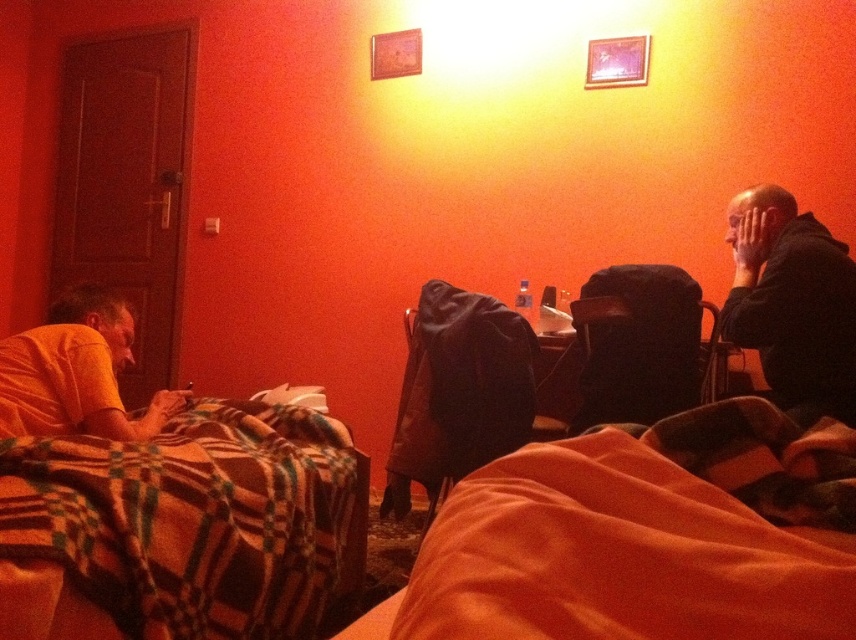
Does plaid fabric blanket at lower left appear under black hoodie at right?

Yes, plaid fabric blanket at lower left is below black hoodie at right.

Which is behind, point (200, 448) or point (792, 387)?

Positioned behind is point (792, 387).

The height and width of the screenshot is (640, 856). What are the coordinates of `plaid fabric blanket at lower left` in the screenshot? It's located at (192, 518).

Is orange soft fabric blanket at lower right positioned behind black hoodie at right?

No, it is in front of black hoodie at right.

Who is positioned more to the left, orange soft fabric blanket at lower right or black hoodie at right?

orange soft fabric blanket at lower right

Is point (605, 465) positioned in front of point (747, 333)?

Yes, point (605, 465) is in front of point (747, 333).

The image size is (856, 640). I want to click on orange soft fabric blanket at lower right, so click(x=649, y=536).

Between orange soft fabric blanket at lower right and black fabric chair at center, which one is positioned higher?

black fabric chair at center is above.

What do you see at coordinates (649, 536) in the screenshot?
I see `orange soft fabric blanket at lower right` at bounding box center [649, 536].

At what (x,y) coordinates should I click in order to perform the action: click on orange soft fabric blanket at lower right. Please return your answer as a coordinate pair (x, y). The image size is (856, 640). Looking at the image, I should click on (649, 536).